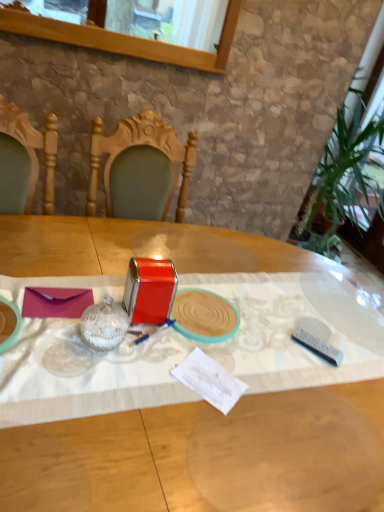
The image size is (384, 512). I want to click on vacant position to the left of white plastic remote at lower right, the first tableware when ordered from right to left, so 265,336.